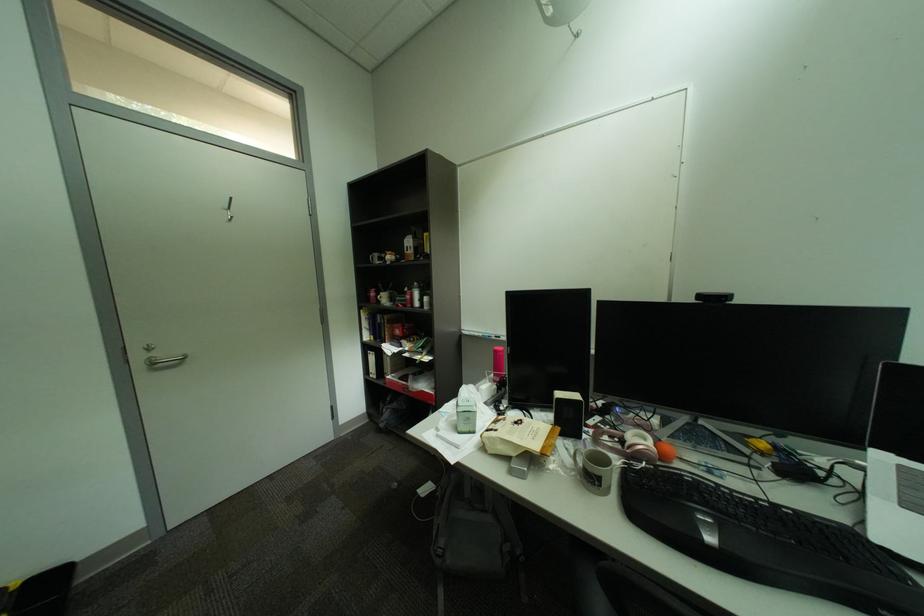
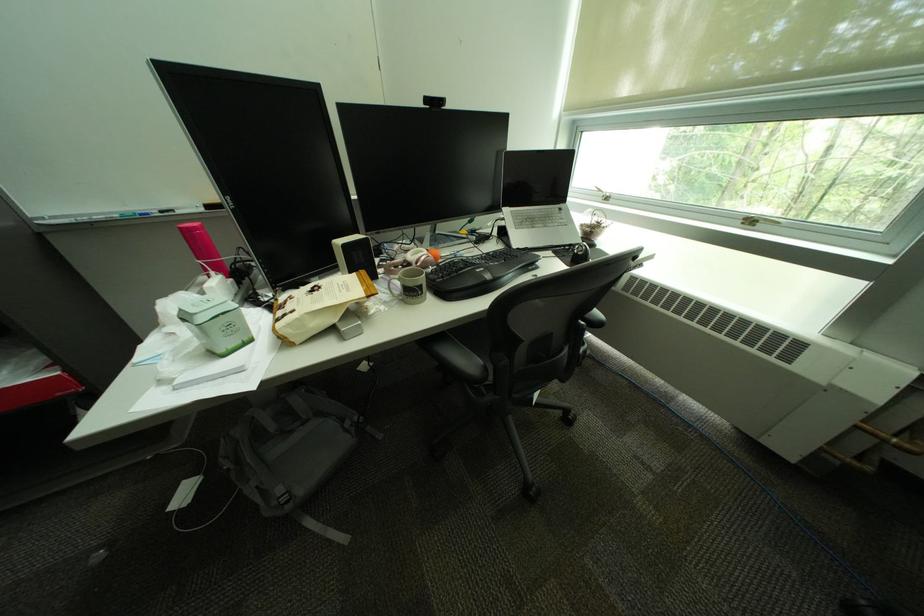
Locate, in the second image, the point that corresponds to (x=505, y=439) in the first image.

(309, 321)